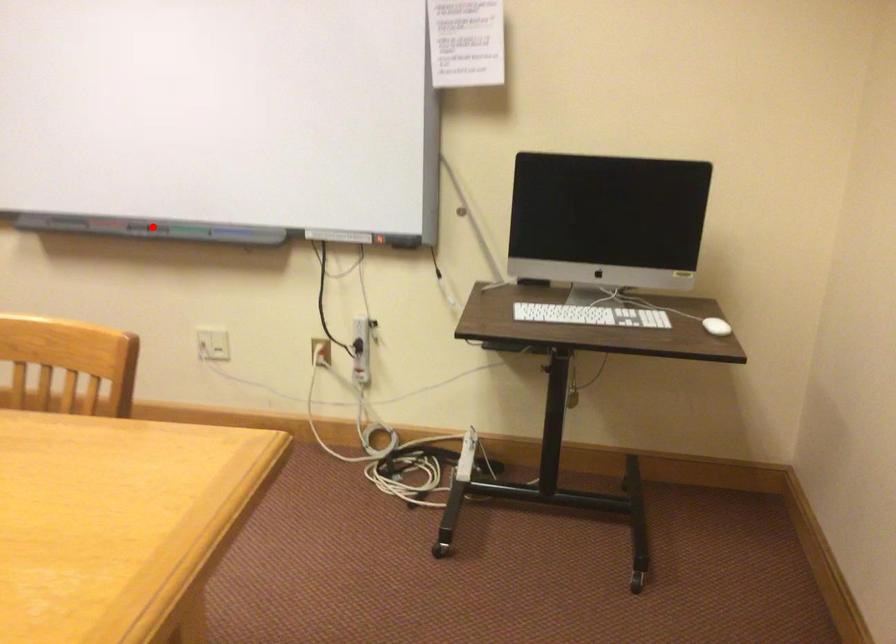
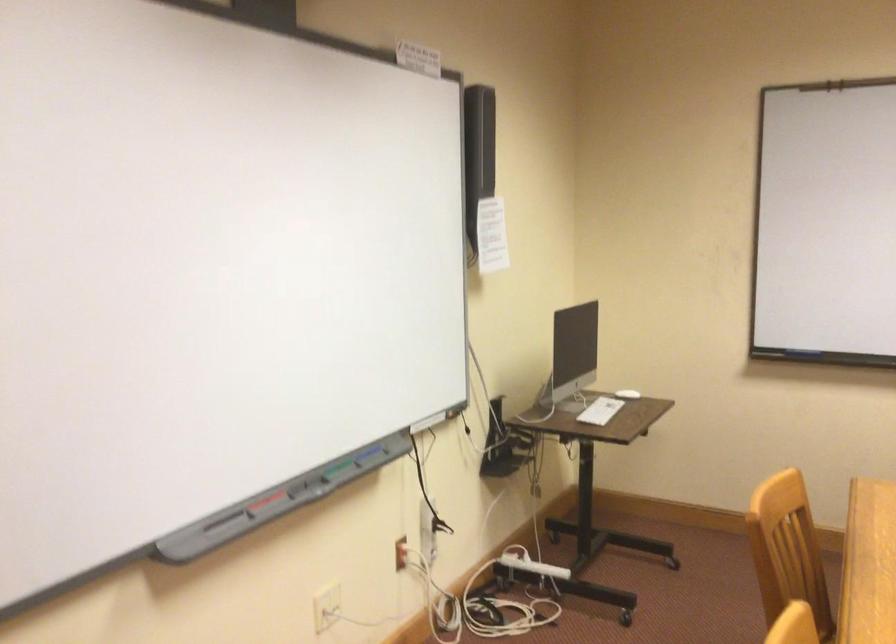
Question: I am providing you with two images of the same scene from different viewpoints. A red point is shown in image1. For the corresponding object point in image2, is it positioned nearer or farther from the camera?

Choices:
 (A) Nearer
 (B) Farther

Answer: (A)